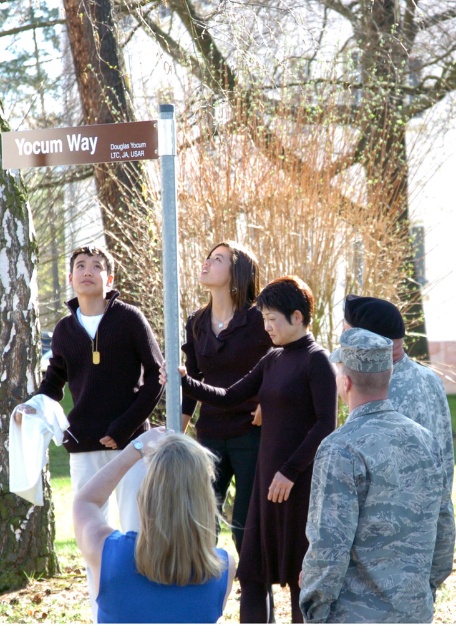
Question: Which object appears closest to the camera in this image?

Choices:
 (A) camouflage uniform at right
 (B) matte black sweater at left
 (C) camouflage fabric uniform at lower center

Answer: (C)

Question: Is matte black sweater at center further to the viewer compared to camouflage fabric uniform at lower center?

Choices:
 (A) no
 (B) yes

Answer: (B)

Question: Which point is farther from the camera taking this photo?

Choices:
 (A) (108, 614)
 (B) (415, 566)
 (C) (21, 212)
 (D) (109, 138)

Answer: (C)

Question: Considering the real-world distances, which object is closest to the matte black sweater at left?

Choices:
 (A) blonde hair at lower center
 (B) brown wooden sign at upper left

Answer: (B)

Question: Can you confirm if camouflage fabric uniform at center is wider than silver metallic pole at center?

Choices:
 (A) yes
 (B) no

Answer: (A)

Question: Does matte black sweater at left have a lesser width compared to brown wooden sign at upper left?

Choices:
 (A) yes
 (B) no

Answer: (A)